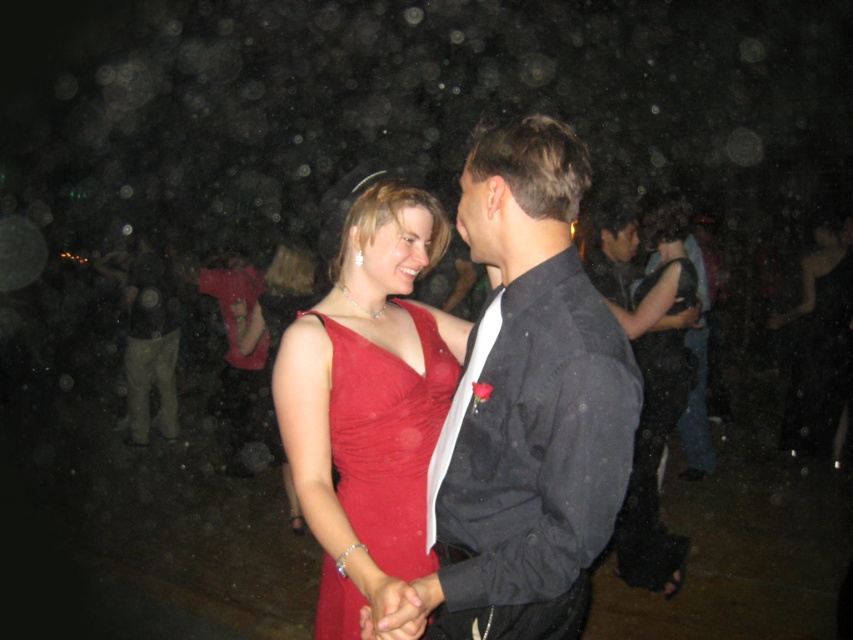
Question: Is shiny black suit at center closer to the viewer compared to matte red dress at center?

Choices:
 (A) yes
 (B) no

Answer: (A)

Question: Which point is closer to the camera taking this photo?

Choices:
 (A) (595, 269)
 (B) (845, 349)
 (C) (503, 550)

Answer: (C)

Question: Considering the relative positions of matte red dress at center and shiny red dress at center in the image provided, where is matte red dress at center located with respect to shiny red dress at center?

Choices:
 (A) right
 (B) left

Answer: (A)

Question: Estimate the real-world distances between objects in this image. Which object is farther from the shiny red dress at center?

Choices:
 (A) matte red dress at center
 (B) shiny black suit at center
 (C) shiny satin dress at center

Answer: (A)

Question: Can you confirm if shiny black suit at center is positioned below black satin dress at center?

Choices:
 (A) no
 (B) yes

Answer: (A)

Question: Based on their relative distances, which object is farther from the shiny red dress at center?

Choices:
 (A) shiny satin dress at center
 (B) matte red dress at center

Answer: (B)